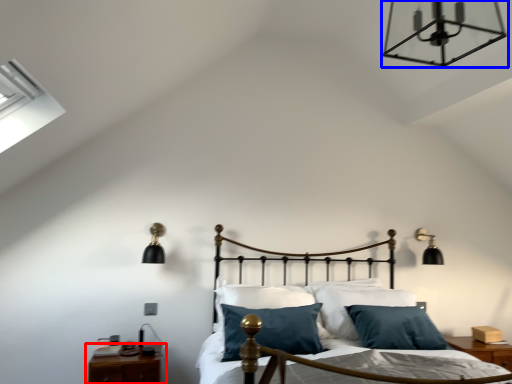
Question: Which point is further to the camera, nightstand (highlighted by a red box) or lamp (highlighted by a blue box)?

Choices:
 (A) nightstand
 (B) lamp

Answer: (A)